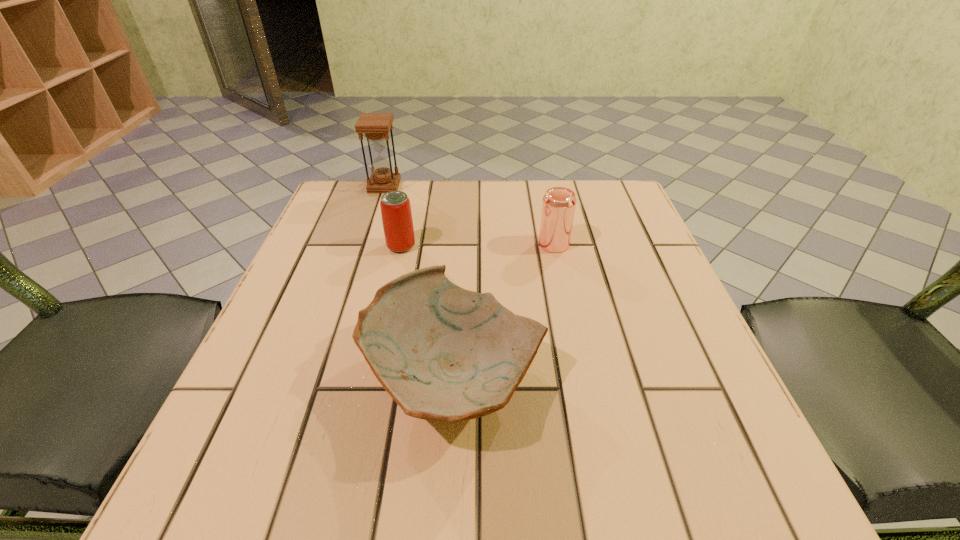
Where is `the farthest object`? The height and width of the screenshot is (540, 960). the farthest object is located at coordinates (376, 126).

This screenshot has height=540, width=960. Identify the location of hourglass. (376, 126).

Where is `the rightmost object`? the rightmost object is located at coordinates (559, 203).

Where is `the left beer can`? Image resolution: width=960 pixels, height=540 pixels. the left beer can is located at coordinates (395, 206).

I want to click on the nearest object, so click(x=443, y=353).

Locate an element on the screen. The width and height of the screenshot is (960, 540). vacant area situated 0.090m on the right of the leftmost object is located at coordinates (434, 186).

Image resolution: width=960 pixels, height=540 pixels. In order to click on free region located 0.400m on the front of the right beer can in this screenshot , I will do `click(592, 425)`.

The image size is (960, 540). Identify the location of vacant space located 0.370m on the front of the left beer can. (365, 409).

Find the location of `free space located 0.270m on the back of the pottery`. free space located 0.270m on the back of the pottery is located at coordinates (462, 227).

You are a GUI agent. You are given a task and a screenshot of the screen. Output one action in this format:
    pyautogui.click(x=<x>, y=<y>)
    Task: Click on the object that is at the far edge
    This screenshot has height=540, width=960.
    Given the screenshot: What is the action you would take?
    pyautogui.click(x=376, y=126)